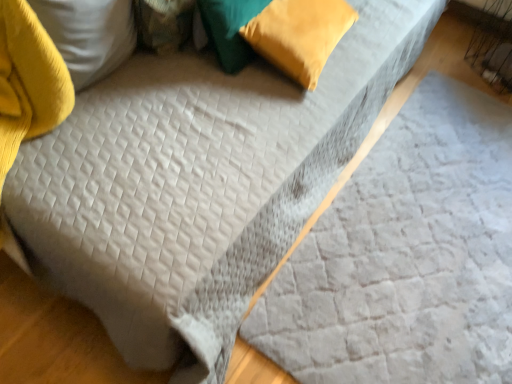
This screenshot has height=384, width=512. What do you see at coordinates (230, 29) in the screenshot?
I see `velvet green pillow at upper center, the second pillow positioned from the left` at bounding box center [230, 29].

You are a GUI agent. You are given a task and a screenshot of the screen. Output one action in this format:
    pyautogui.click(x=<x>, y=<y>)
    Task: Click on the velvet green pillow at upper center, which ranks as the second pillow in right-to-left order
    
    Given the screenshot: What is the action you would take?
    pyautogui.click(x=230, y=29)

In the image, is velvet green pillow at upper center, which ranks as the second pillow in right-to-left order, positioned in front of or behind gray quilted sheet at center?

Visually, velvet green pillow at upper center, which ranks as the second pillow in right-to-left order, is located behind gray quilted sheet at center.

Between point (223, 7) and point (410, 370), which one is positioned behind?

The point (410, 370) is more distant.

From the image's perspective, which is below, velvet green pillow at upper center, which ranks as the second pillow in right-to-left order, or gray quilted sheet at center?

gray quilted sheet at center is shown below in the image.

Is velvet green pillow at upper center, the second pillow positioned from the left, taller than gray quilted sheet at center?

Yes.

Considering the relative positions of gray quilted sheet at center and velvet green pillow at upper left, which appears as the 1th pillow when viewed from the left, in the image provided, is gray quilted sheet at center to the left or to the right of velvet green pillow at upper left, which appears as the 1th pillow when viewed from the left,?

Based on their positions, gray quilted sheet at center is located to the right of velvet green pillow at upper left, which appears as the 1th pillow when viewed from the left.

Which pillow is the 1st one when counting from the back of the gray quilted sheet at center? Please provide its 2D coordinates.

[(164, 23)]

Is gray quilted sheet at center oriented away from velvet green pillow at upper left, which ranks as the 3th pillow in right-to-left order?

No.

Which is in front, point (475, 329) or point (232, 51)?

The point (232, 51) is more forward.

Considering the positions of objects gray quilted sheet at center and velvet green pillow at upper center, which ranks as the second pillow in right-to-left order, in the image provided, who is more to the right, gray quilted sheet at center or velvet green pillow at upper center, which ranks as the second pillow in right-to-left order,?

gray quilted sheet at center is more to the right.

From the image's perspective, who appears lower, gray quilted sheet at center or velvet green pillow at upper center, the second pillow positioned from the left?

gray quilted sheet at center appears lower in the image.

Considering the relative sizes of gray quilted sheet at center and velvet green pillow at upper center, the second pillow positioned from the left, in the image provided, is gray quilted sheet at center thinner than velvet green pillow at upper center, the second pillow positioned from the left,?

No, gray quilted sheet at center is not thinner than velvet green pillow at upper center, the second pillow positioned from the left.

Find the location of a particular element. the 1st pillow counting from the left of the velvet yellow pillow at upper right, marked as the 1th pillow in a right-to-left arrangement is located at coordinates (230, 29).

Who is shorter, velvet yellow pillow at upper right, marked as the 1th pillow in a right-to-left arrangement, or velvet green pillow at upper center, which ranks as the second pillow in right-to-left order?

With less height is velvet yellow pillow at upper right, marked as the 1th pillow in a right-to-left arrangement.

Consider the image. Is velvet yellow pillow at upper right, the third pillow in the left-to-right sequence, not near velvet green pillow at upper center, the second pillow positioned from the left?

No, velvet yellow pillow at upper right, the third pillow in the left-to-right sequence, is not far from velvet green pillow at upper center, the second pillow positioned from the left.

From a real-world perspective, is velvet yellow pillow at upper right, the third pillow in the left-to-right sequence, located beneath velvet green pillow at upper center, which ranks as the second pillow in right-to-left order?

Indeed, from a real-world perspective, velvet yellow pillow at upper right, the third pillow in the left-to-right sequence, is positioned beneath velvet green pillow at upper center, which ranks as the second pillow in right-to-left order.

From a real-world perspective, which object stands above the other?

velvet green pillow at upper left, which appears as the 1th pillow when viewed from the left, is physically above.

Considering the points (175, 14) and (251, 26), which point is in front, point (175, 14) or point (251, 26)?

The point (175, 14) is in front.

Between velvet green pillow at upper left, which ranks as the 3th pillow in right-to-left order, and velvet yellow pillow at upper right, the third pillow in the left-to-right sequence, which one has larger width?

velvet yellow pillow at upper right, the third pillow in the left-to-right sequence, is wider.

Would you consider velvet green pillow at upper left, which ranks as the 3th pillow in right-to-left order, to be distant from velvet yellow pillow at upper right, marked as the 1th pillow in a right-to-left arrangement?

No, there isn't a large distance between velvet green pillow at upper left, which ranks as the 3th pillow in right-to-left order, and velvet yellow pillow at upper right, marked as the 1th pillow in a right-to-left arrangement.

Is velvet green pillow at upper left, which ranks as the 3th pillow in right-to-left order, looking in the opposite direction of gray quilted sheet at center?

No, velvet green pillow at upper left, which ranks as the 3th pillow in right-to-left order,'s orientation is not away from gray quilted sheet at center.

In terms of height, does velvet green pillow at upper left, which appears as the 1th pillow when viewed from the left, look taller or shorter compared to gray quilted sheet at center?

In the image, velvet green pillow at upper left, which appears as the 1th pillow when viewed from the left, appears to be taller than gray quilted sheet at center.

Which is nearer, [139,15] or [390,150]?

The point [139,15] is closer to the camera.

Which of these two, velvet green pillow at upper left, which ranks as the 3th pillow in right-to-left order, or gray quilted sheet at center, is smaller?

velvet green pillow at upper left, which ranks as the 3th pillow in right-to-left order.

Is gray quilted sheet at center oriented away from velvet yellow pillow at upper right, marked as the 1th pillow in a right-to-left arrangement?

No, gray quilted sheet at center is not facing away from velvet yellow pillow at upper right, marked as the 1th pillow in a right-to-left arrangement.

Which object is closer to the camera taking this photo, gray quilted sheet at center or velvet yellow pillow at upper right, marked as the 1th pillow in a right-to-left arrangement?

Positioned in front is gray quilted sheet at center.

Which of these two, gray quilted sheet at center or velvet yellow pillow at upper right, the third pillow in the left-to-right sequence, stands taller?

With more height is velvet yellow pillow at upper right, the third pillow in the left-to-right sequence.

Considering the positions of point (311, 371) and point (245, 33), is point (311, 371) closer or farther from the camera than point (245, 33)?

Point (311, 371) is positioned closer to the camera compared to point (245, 33).

In order to click on the 2nd pillow to the left when counting from the gray quilted sheet at center in this screenshot , I will do `click(230, 29)`.

This screenshot has height=384, width=512. In the image, there is a velvet green pillow at upper left, which appears as the 1th pillow when viewed from the left. What are the coordinates of `sheet below it (from a real-world perspective)` in the screenshot? It's located at (406, 256).

Based on their spatial positions, is gray quilted sheet at center or velvet green pillow at upper center, the second pillow positioned from the left, closer to velvet yellow pillow at upper right, the third pillow in the left-to-right sequence?

velvet green pillow at upper center, the second pillow positioned from the left, lies closer to velvet yellow pillow at upper right, the third pillow in the left-to-right sequence, than the other object.

Considering their positions, is velvet yellow pillow at upper right, the third pillow in the left-to-right sequence, positioned closer to gray quilted sheet at center than velvet green pillow at upper center, which ranks as the second pillow in right-to-left order?

velvet yellow pillow at upper right, the third pillow in the left-to-right sequence, is closer to gray quilted sheet at center.

Estimate the real-world distances between objects in this image. Which object is closer to velvet green pillow at upper center, which ranks as the second pillow in right-to-left order, velvet green pillow at upper left, which appears as the 1th pillow when viewed from the left, or velvet yellow pillow at upper right, the third pillow in the left-to-right sequence?

velvet yellow pillow at upper right, the third pillow in the left-to-right sequence, is positioned closer to the anchor velvet green pillow at upper center, which ranks as the second pillow in right-to-left order.

Considering their positions, is velvet green pillow at upper center, the second pillow positioned from the left, positioned closer to velvet green pillow at upper left, which ranks as the 3th pillow in right-to-left order, than gray quilted sheet at center?

Based on the image, velvet green pillow at upper center, the second pillow positioned from the left, appears to be nearer to velvet green pillow at upper left, which ranks as the 3th pillow in right-to-left order.

Based on their spatial positions, is velvet green pillow at upper left, which ranks as the 3th pillow in right-to-left order, or velvet green pillow at upper center, the second pillow positioned from the left, closer to gray quilted sheet at center?

velvet green pillow at upper center, the second pillow positioned from the left, is positioned closer to the anchor gray quilted sheet at center.

From the image, which object appears to be farther from velvet yellow pillow at upper right, the third pillow in the left-to-right sequence, gray quilted sheet at center or velvet green pillow at upper left, which ranks as the 3th pillow in right-to-left order?

Among the two, gray quilted sheet at center is located further to velvet yellow pillow at upper right, the third pillow in the left-to-right sequence.

Estimate the real-world distances between objects in this image. Which object is further from velvet yellow pillow at upper right, the third pillow in the left-to-right sequence, velvet green pillow at upper left, which appears as the 1th pillow when viewed from the left, or velvet green pillow at upper center, the second pillow positioned from the left?

Among the two, velvet green pillow at upper left, which appears as the 1th pillow when viewed from the left, is located further to velvet yellow pillow at upper right, the third pillow in the left-to-right sequence.

Which object lies nearer to the anchor point velvet yellow pillow at upper right, marked as the 1th pillow in a right-to-left arrangement, velvet green pillow at upper center, which ranks as the second pillow in right-to-left order, or gray quilted sheet at center?

velvet green pillow at upper center, which ranks as the second pillow in right-to-left order, is closer to velvet yellow pillow at upper right, marked as the 1th pillow in a right-to-left arrangement.

You are a GUI agent. You are given a task and a screenshot of the screen. Output one action in this format:
    pyautogui.click(x=<x>, y=<y>)
    Task: Click on the pillow between velvet green pillow at upper left, which appears as the 1th pillow when viewed from the left, and velvet yellow pillow at upper right, the third pillow in the left-to-right sequence, from left to right
    The image size is (512, 384).
    Given the screenshot: What is the action you would take?
    pyautogui.click(x=230, y=29)